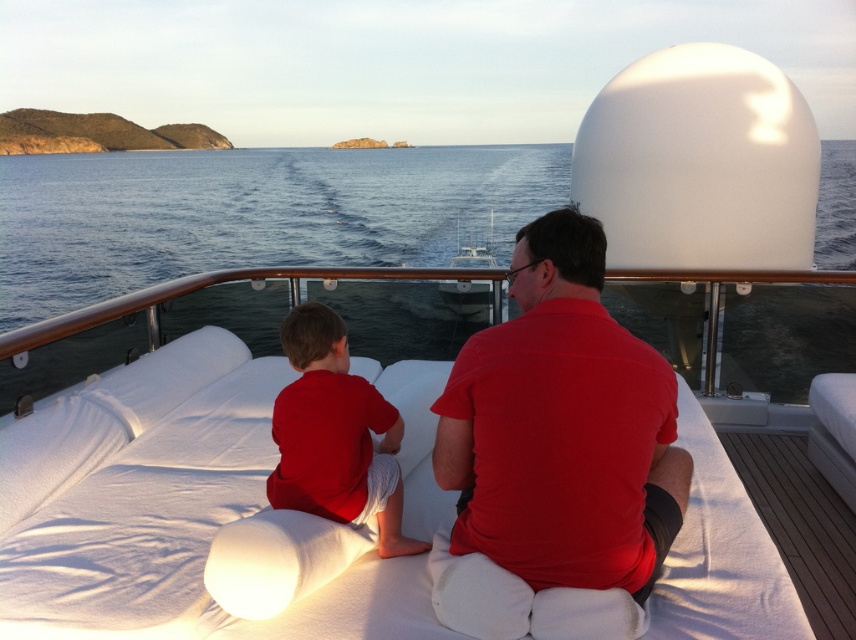
Which is more to the left, red matte shirt at center or matte red shirt at center?

matte red shirt at center is more to the left.

Is red matte shirt at center bigger than matte red shirt at center?

Indeed, red matte shirt at center has a larger size compared to matte red shirt at center.

Describe the element at coordinates (556, 456) in the screenshot. This screenshot has height=640, width=856. I see `red matte shirt at center` at that location.

You are a GUI agent. You are given a task and a screenshot of the screen. Output one action in this format:
    pyautogui.click(x=<x>, y=<y>)
    Task: Click on the red matte shirt at center
    The height and width of the screenshot is (640, 856).
    Given the screenshot: What is the action you would take?
    pyautogui.click(x=556, y=456)

Who is more distant from viewer, (563,356) or (776,490)?

Point (776,490)

Find the location of a particular element. Image resolution: width=856 pixels, height=640 pixels. red matte shirt at center is located at coordinates (556, 456).

Is matte red shirt at center behind white wood deck at lower right?

No, it is not.

Which is above, matte red shirt at center or white wood deck at lower right?

matte red shirt at center is above.

Is point (348, 508) closer to viewer compared to point (759, 484)?

That is True.

In order to click on matte red shirt at center in this screenshot , I will do `click(336, 433)`.